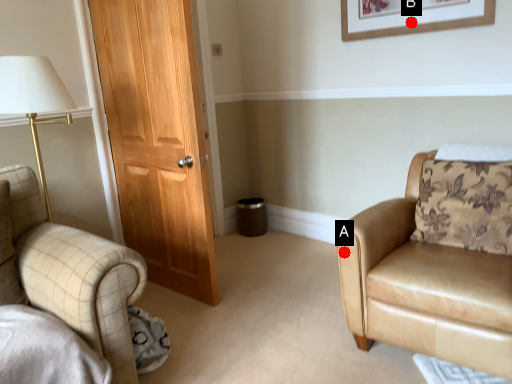
Question: Two points are circled on the image, labeled by A and B beside each circle. Which point is farther from the camera taking this photo?

Choices:
 (A) A is further
 (B) B is further

Answer: (B)